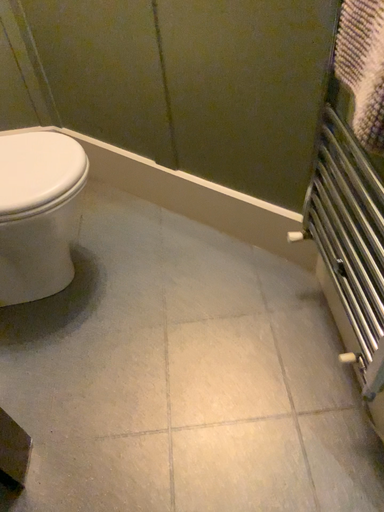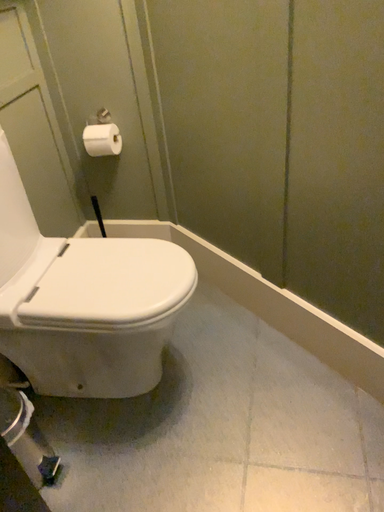
Question: Which way did the camera rotate in the video?

Choices:
 (A) rotated left
 (B) rotated right

Answer: (A)